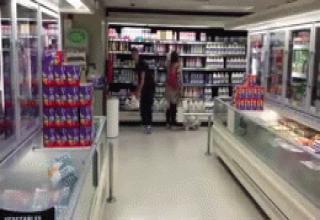
Where is `glass sliding cabinet`? glass sliding cabinet is located at coordinates (300, 64), (279, 59), (253, 55), (7, 100), (23, 85), (48, 29).